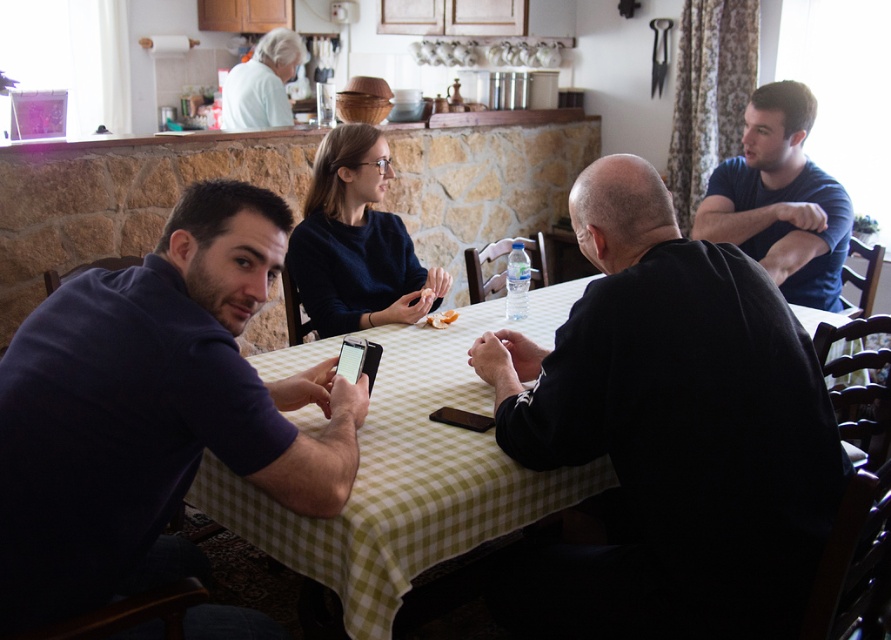
Which is above, black matte shirt at center or dark blue t-shirt at right?

dark blue t-shirt at right is higher up.

Between point (598, 392) and point (781, 118), which one is positioned behind?

Point (781, 118)

In order to click on black matte shirt at center in this screenshot , I will do coord(668,433).

Is green checkered tablecloth at center to the right of dark blue t-shirt at right from the viewer's perspective?

Incorrect, green checkered tablecloth at center is not on the right side of dark blue t-shirt at right.

Measure the distance between point (426, 401) and camera.

The distance of point (426, 401) from camera is 1.75 meters.

What are the coordinates of `green checkered tablecloth at center` in the screenshot? It's located at (413, 472).

Does dark blue cotton shirt at left come behind green checkered tablecloth at center?

That is False.

Is point (83, 595) more distant than point (381, 369)?

No, (83, 595) is in front of (381, 369).

Is point (87, 401) less distant than point (382, 444)?

Yes, it is in front of point (382, 444).

This screenshot has width=891, height=640. I want to click on dark blue cotton shirt at left, so click(153, 410).